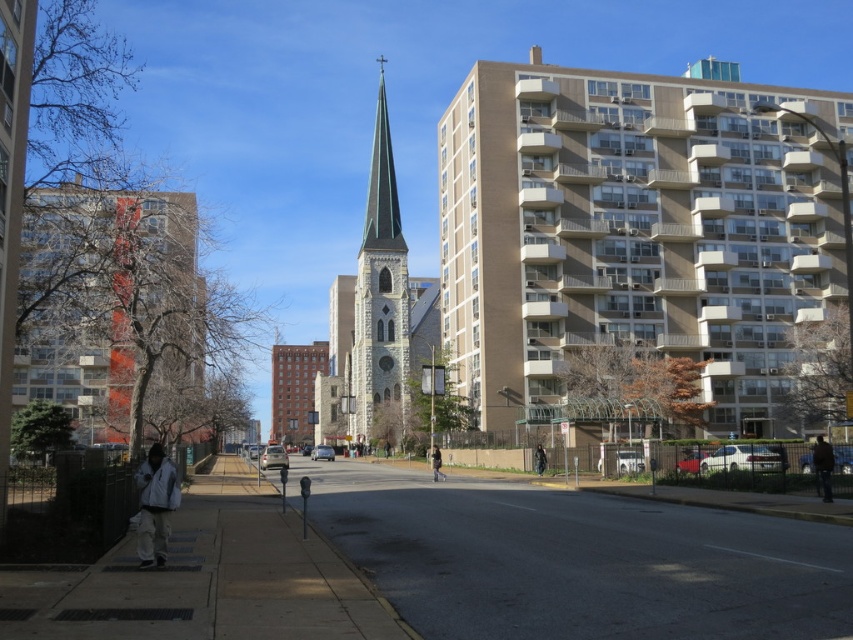
You are a delivery drone flying above an urban area. You need to land on the gray asphalt road at center. What coordinates should you aim for?

The gray asphalt road at center is located at coordinates point (576,561), so the drone should aim for those coordinates to land safely.

You are standing on the sidewalk and want to walk towards the church steeple. Which point, point [820,467] or point [546,461], is closer to you as you face the steeple?

Point [820,467] is closer to the viewer than point [546,461].